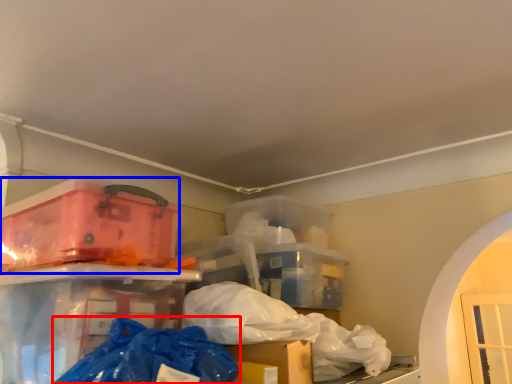
Question: Which of the following is the closest to the observer, plastic bag (highlighted by a red box) or box (highlighted by a blue box)?

Choices:
 (A) plastic bag
 (B) box

Answer: (A)